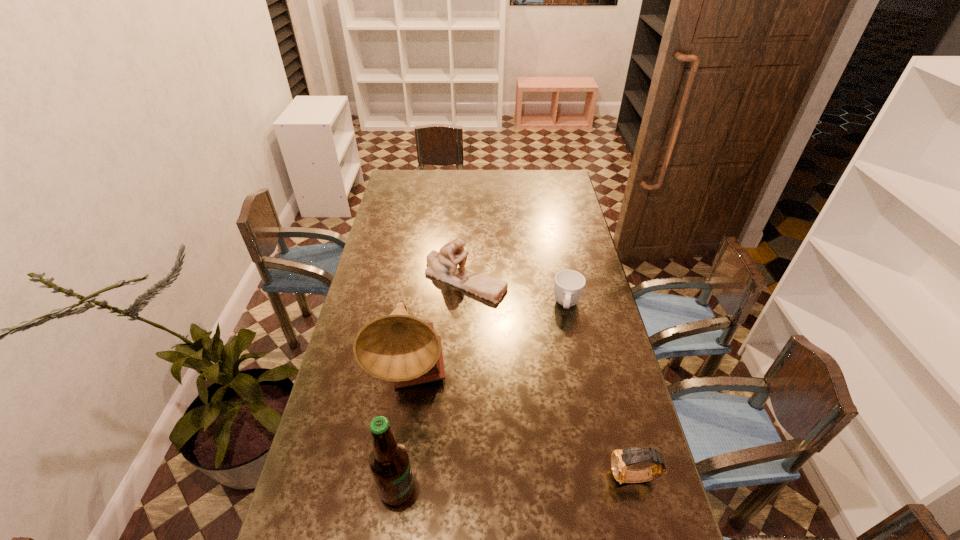
In order to click on the second tallest object in this screenshot , I will do (x=389, y=462).

At what (x,y) coordinates should I click in order to perform the action: click on watch. Please return your answer as a coordinate pair (x, y). The height and width of the screenshot is (540, 960). Looking at the image, I should click on (620, 459).

Where is `figurine`? The width and height of the screenshot is (960, 540). figurine is located at coordinates (442, 265).

I want to click on cup, so click(x=569, y=284).

Locate an element on the screen. the third farthest object is located at coordinates (398, 347).

Where is `the tallest object`? This screenshot has height=540, width=960. the tallest object is located at coordinates (398, 347).

Locate an element on the screen. This screenshot has width=960, height=540. free region located on the label of the beer bottle is located at coordinates (570, 489).

Find the location of `free spot located on the face of the watch`. free spot located on the face of the watch is located at coordinates (549, 478).

I want to click on free spot located 0.180m on the face of the watch, so click(x=541, y=478).

This screenshot has width=960, height=540. I want to click on free space located on the face of the watch, so click(519, 478).